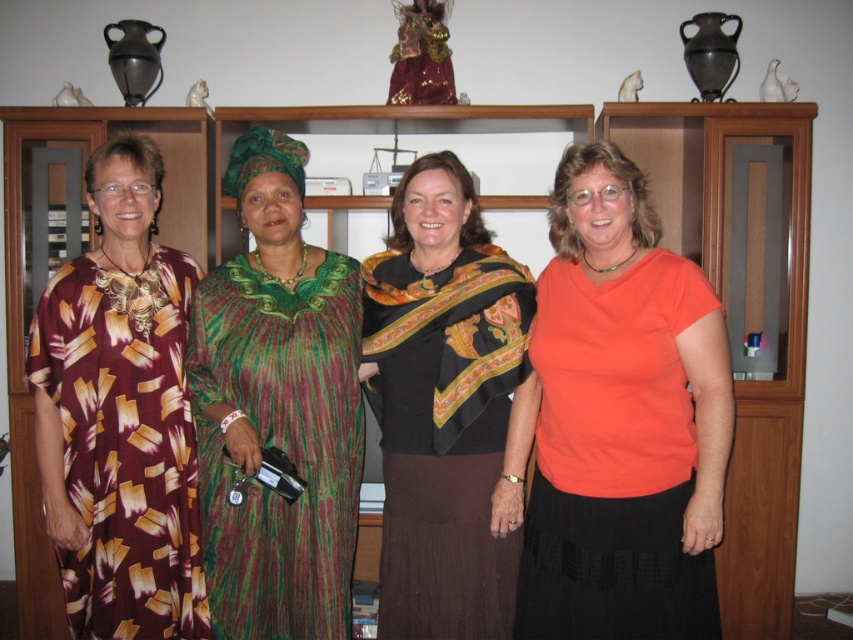
In the scene shown: Which is below, green textured dress at center or black satin scarf at center?

black satin scarf at center is lower down.

Which of these two, green textured dress at center or black satin scarf at center, stands shorter?

Standing shorter between the two is black satin scarf at center.

Is point (210, 429) positioned after point (445, 339)?

Yes.

Locate an element on the screen. Image resolution: width=853 pixels, height=640 pixels. green textured dress at center is located at coordinates (277, 410).

Can you confirm if maroon printed dress at left is positioned below black satin scarf at center?

No.

Who is positioned more to the right, maroon printed dress at left or black satin scarf at center?

black satin scarf at center

Is point (120, 141) behind point (514, 540)?

Yes, it is behind point (514, 540).

Identify the location of maroon printed dress at left. This screenshot has width=853, height=640. (120, 413).

Is orange matte shirt at center below green textured dress at center?

Indeed, orange matte shirt at center is positioned under green textured dress at center.

Is point (618, 301) behind point (231, 148)?

No, (618, 301) is in front of (231, 148).

The width and height of the screenshot is (853, 640). I want to click on orange matte shirt at center, so click(x=622, y=420).